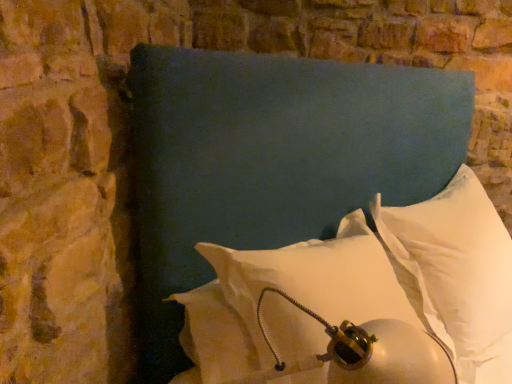
Question: Can we say white soft pillow at center, the second pillow from the right, lies outside white soft pillow at center, arranged as the 3th pillow when viewed from the left?

Choices:
 (A) no
 (B) yes

Answer: (B)

Question: Considering the relative positions of white soft pillow at center, arranged as the 2th pillow when viewed from the left, and white soft pillow at center, which is the 1th pillow in right-to-left order, in the image provided, is white soft pillow at center, arranged as the 2th pillow when viewed from the left, to the left of white soft pillow at center, which is the 1th pillow in right-to-left order, from the viewer's perspective?

Choices:
 (A) yes
 (B) no

Answer: (A)

Question: Is white soft pillow at center, arranged as the 2th pillow when viewed from the left, in contact with white soft pillow at center, which is the 1th pillow in right-to-left order?

Choices:
 (A) yes
 (B) no

Answer: (B)

Question: Is white soft pillow at center, the second pillow from the right, thinner than white soft pillow at center, which is the 1th pillow in right-to-left order?

Choices:
 (A) yes
 (B) no

Answer: (B)

Question: Is white soft pillow at center, arranged as the 2th pillow when viewed from the left, smaller than white soft pillow at center, which is the 1th pillow in right-to-left order?

Choices:
 (A) no
 (B) yes

Answer: (A)

Question: Does white soft pillow at center, the second pillow from the right, appear on the right side of white soft pillow at center, which is the 1th pillow in right-to-left order?

Choices:
 (A) yes
 (B) no

Answer: (B)

Question: Does white soft pillow at lower right, the 3th pillow from the right, lie in front of white soft pillow at center, arranged as the 2th pillow when viewed from the left?

Choices:
 (A) no
 (B) yes

Answer: (A)

Question: Is white soft pillow at lower right, the 3th pillow from the right, wider than white soft pillow at center, the second pillow from the right?

Choices:
 (A) no
 (B) yes

Answer: (A)

Question: From the image's perspective, is white soft pillow at lower right, the 3th pillow from the right, below white soft pillow at center, the second pillow from the right?

Choices:
 (A) no
 (B) yes

Answer: (B)

Question: From a real-world perspective, is white soft pillow at lower right, the 3th pillow from the right, on top of white soft pillow at center, the second pillow from the right?

Choices:
 (A) no
 (B) yes

Answer: (A)

Question: Is white soft pillow at lower right, placed as the first pillow when sorted from left to right, far from white soft pillow at center, arranged as the 2th pillow when viewed from the left?

Choices:
 (A) no
 (B) yes

Answer: (A)

Question: Considering the relative positions of white soft pillow at lower right, placed as the first pillow when sorted from left to right, and white soft pillow at center, arranged as the 2th pillow when viewed from the left, in the image provided, is white soft pillow at lower right, placed as the first pillow when sorted from left to right, behind white soft pillow at center, arranged as the 2th pillow when viewed from the left,?

Choices:
 (A) yes
 (B) no

Answer: (A)

Question: Is white soft pillow at center, arranged as the 3th pillow when viewed from the left, aimed at white soft pillow at center, arranged as the 2th pillow when viewed from the left?

Choices:
 (A) no
 (B) yes

Answer: (A)